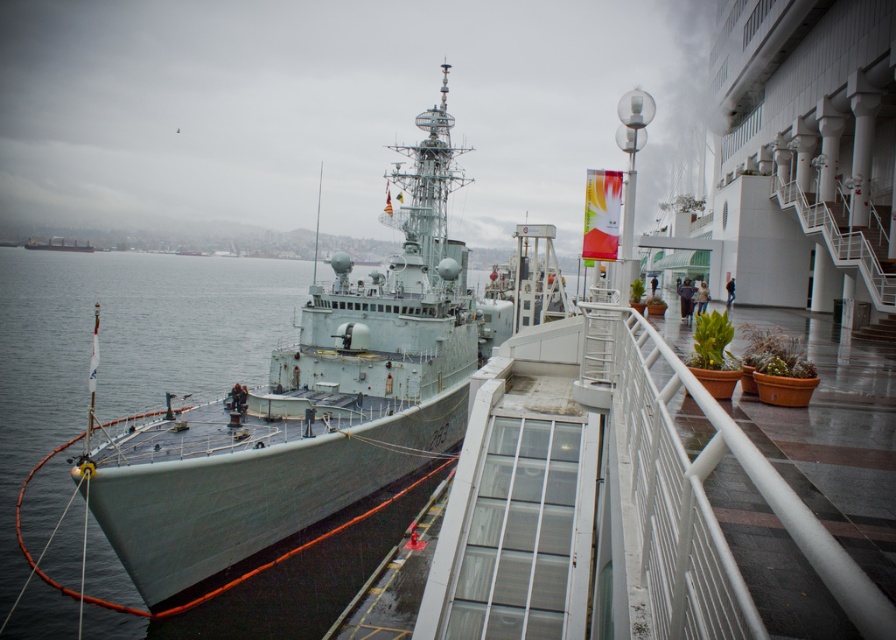
Question: Does gray metallic ship at center have a greater width compared to gray metallic water at left?

Choices:
 (A) yes
 (B) no

Answer: (B)

Question: Is gray metallic ship at center wider than gray metallic water at left?

Choices:
 (A) yes
 (B) no

Answer: (B)

Question: Does gray metallic ship at center have a greater width compared to gray metallic water at left?

Choices:
 (A) yes
 (B) no

Answer: (B)

Question: Which point is farther from the camera taking this photo?

Choices:
 (A) (414, 445)
 (B) (36, 387)

Answer: (B)

Question: Which point is farther from the camera taking this photo?

Choices:
 (A) (268, 321)
 (B) (429, 358)

Answer: (A)

Question: Which point is closer to the camera?

Choices:
 (A) (151, 321)
 (B) (309, 365)

Answer: (B)